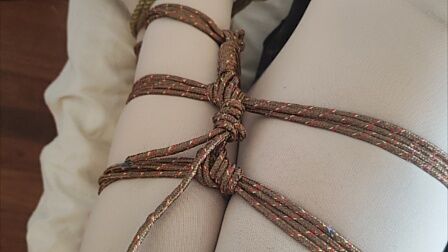
Identify the location of floor. Image resolution: width=448 pixels, height=252 pixels. (32, 99).